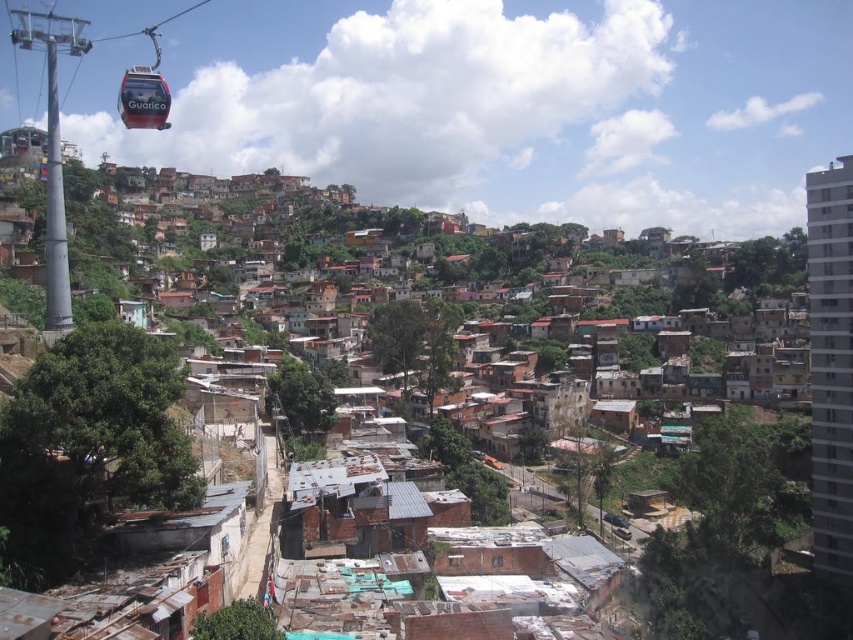
Question: Which point appears closest to the camera in this image?

Choices:
 (A) (91, 509)
 (B) (164, 128)

Answer: (A)

Question: Can you confirm if brown corrugated metal rooftops at center is positioned below red glossy cable car at upper left?

Choices:
 (A) yes
 (B) no

Answer: (A)

Question: Which point appears closest to the camera in this image?

Choices:
 (A) (90, 189)
 (B) (141, 80)

Answer: (B)

Question: Does brown corrugated metal rooftops at center come in front of red glossy cable car at upper left?

Choices:
 (A) no
 (B) yes

Answer: (B)

Question: Which point is farther to the camera?

Choices:
 (A) brown corrugated metal rooftops at center
 (B) red glossy cable car at upper left

Answer: (B)

Question: Does brown corrugated metal rooftops at center appear on the left side of red glossy cable car at upper left?

Choices:
 (A) yes
 (B) no

Answer: (B)